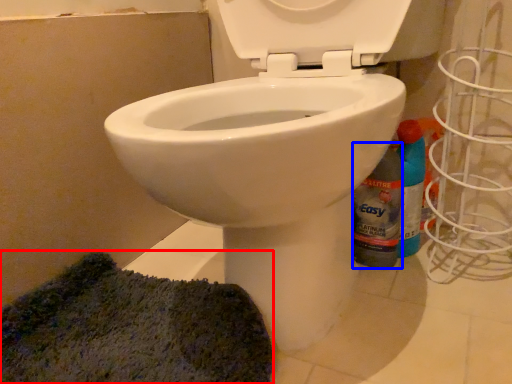
Question: Among these objects, which one is farthest to the camera, doormat (highlighted by a red box) or bottle (highlighted by a blue box)?

Choices:
 (A) doormat
 (B) bottle

Answer: (B)